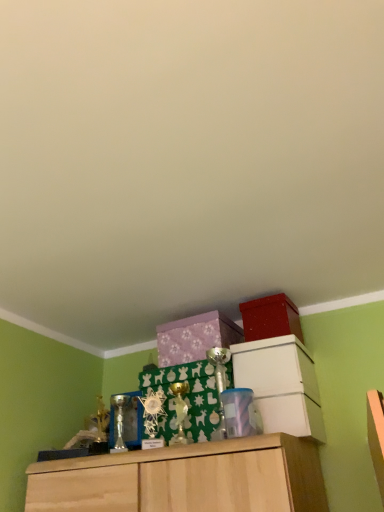
Question: Is point (286, 330) positioned closer to the camera than point (195, 351)?

Choices:
 (A) farther
 (B) closer

Answer: (B)

Question: Considering the positions of matte red storage box at upper right and purple matte box at center, the 1th cabinetry in the left-to-right sequence, in the image, is matte red storage box at upper right taller or shorter than purple matte box at center, the 1th cabinetry in the left-to-right sequence,?

Choices:
 (A) short
 (B) tall

Answer: (B)

Question: Considering the real-world distances, which object is farthest from the white matte cabinet at upper center, the 2th cabinetry viewed from the left?

Choices:
 (A) matte red storage box at upper right
 (B) translucent plastic container at center
 (C) purple matte box at center, positioned as the second cabinetry in right-to-left order

Answer: (C)

Question: Estimate the real-world distances between objects in this image. Which object is closer to the purple matte box at center, the 1th cabinetry in the left-to-right sequence?

Choices:
 (A) translucent plastic container at center
 (B) matte red storage box at upper right
 (C) white matte cabinet at upper center, the 2th cabinetry viewed from the left

Answer: (B)